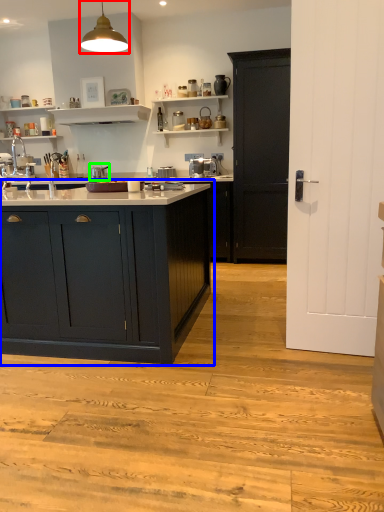
Question: Estimate the real-world distances between objects in this image. Which object is farther from light fixture (highlighted by a red box), cabinetry (highlighted by a blue box) or appliance (highlighted by a green box)?

Choices:
 (A) cabinetry
 (B) appliance

Answer: (B)